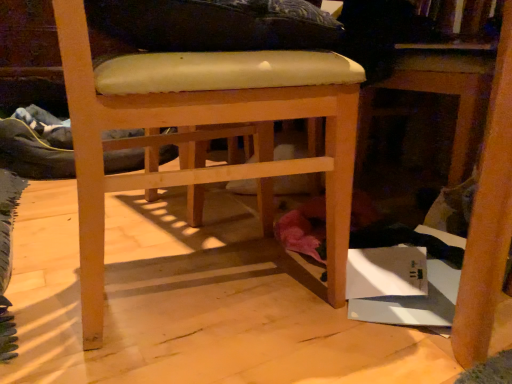
What is the approximate height of light brown wood chair at center?

light brown wood chair at center is 22.18 inches in height.

Locate an element on the screen. The image size is (512, 384). light brown wood chair at center is located at coordinates (202, 133).

Image resolution: width=512 pixels, height=384 pixels. Describe the element at coordinates (202, 133) in the screenshot. I see `light brown wood chair at center` at that location.

Looking at this image, in order to face wooden table at lower right, should I rotate leftwards or rightwards?

It's best to rotate right around 26.553 degrees.

The height and width of the screenshot is (384, 512). Describe the element at coordinates (436, 93) in the screenshot. I see `wooden table at lower right` at that location.

Measure the distance between wooden table at lower right and camera.

35.35 inches.

The height and width of the screenshot is (384, 512). I want to click on wooden table at lower right, so click(x=436, y=93).

Locate an element on the screen. This screenshot has height=384, width=512. light brown wood chair at center is located at coordinates (202, 133).

Between light brown wood chair at center and wooden table at lower right, which one appears on the right side from the viewer's perspective?

wooden table at lower right is more to the right.

Which object is closer to the camera taking this photo, light brown wood chair at center or wooden table at lower right?

light brown wood chair at center is more forward.

Considering the points (227, 106) and (460, 167), which point is behind, point (227, 106) or point (460, 167)?

The point (460, 167) is more distant.

From the image's perspective, relative to wooden table at lower right, is light brown wood chair at center above or below?

light brown wood chair at center is below wooden table at lower right.

From a real-world perspective, between light brown wood chair at center and wooden table at lower right, who is vertically lower?

light brown wood chair at center is physically lower.

Looking at their sizes, would you say light brown wood chair at center is wider or thinner than wooden table at lower right?

light brown wood chair at center is thinner than wooden table at lower right.

Does light brown wood chair at center have a lesser height compared to wooden table at lower right?

No, light brown wood chair at center is not shorter than wooden table at lower right.

Who is bigger, light brown wood chair at center or wooden table at lower right?

Bigger between the two is light brown wood chair at center.

Is light brown wood chair at center situated inside wooden table at lower right or outside?

light brown wood chair at center is located beyond the bounds of wooden table at lower right.

Is light brown wood chair at center next to wooden table at lower right and touching it?

light brown wood chair at center is not next to wooden table at lower right, and they're not touching.

Could you tell me if light brown wood chair at center is turned towards wooden table at lower right?

Yes, light brown wood chair at center is turned towards wooden table at lower right.

How much distance is there between light brown wood chair at center and wooden table at lower right?

light brown wood chair at center and wooden table at lower right are 22.11 inches apart.

Find the location of a particular element. The image size is (512, 384). table behind the light brown wood chair at center is located at coordinates (436, 93).

Looking at this image, considering the positions of objects wooden table at lower right and light brown wood chair at center in the image provided, who is more to the right, wooden table at lower right or light brown wood chair at center?

wooden table at lower right is more to the right.

Is wooden table at lower right closer to camera compared to light brown wood chair at center?

No, the depth of wooden table at lower right is greater than that of light brown wood chair at center.

Which point is more forward, (465, 97) or (342, 63)?

Point (342, 63)

From the image's perspective, is wooden table at lower right above light brown wood chair at center?

Correct, wooden table at lower right appears higher than light brown wood chair at center in the image.

From a real-world perspective, which is physically below, wooden table at lower right or light brown wood chair at center?

In real-world perspective, light brown wood chair at center is lower.

Considering the relative sizes of wooden table at lower right and light brown wood chair at center in the image provided, is wooden table at lower right thinner than light brown wood chair at center?

No.

Between wooden table at lower right and light brown wood chair at center, which one has more height?

With more height is light brown wood chair at center.

Can you confirm if wooden table at lower right is bigger than light brown wood chair at center?

Actually, wooden table at lower right might be smaller than light brown wood chair at center.

Is wooden table at lower right inside the boundaries of light brown wood chair at center, or outside?

The correct answer is: outside.

Is wooden table at lower right placed right next to light brown wood chair at center?

No, wooden table at lower right is not next to light brown wood chair at center.

Is wooden table at lower right facing away from light brown wood chair at center?

wooden table at lower right does not have its back to light brown wood chair at center.

Can you tell me how much wooden table at lower right and light brown wood chair at center differ in facing direction?

The angle between the facing direction of wooden table at lower right and the facing direction of light brown wood chair at center is 170 degrees.

The width and height of the screenshot is (512, 384). I want to click on chair in front of the wooden table at lower right, so click(202, 133).

Find the location of `chair below the wooden table at lower right (from the image's perspective)`. chair below the wooden table at lower right (from the image's perspective) is located at coordinates (x=202, y=133).

You are a GUI agent. You are given a task and a screenshot of the screen. Output one action in this format:
    pyautogui.click(x=<x>, y=<y>)
    Task: Click on the table on the right of light brown wood chair at center
    Image resolution: width=512 pixels, height=384 pixels.
    Given the screenshot: What is the action you would take?
    pyautogui.click(x=436, y=93)